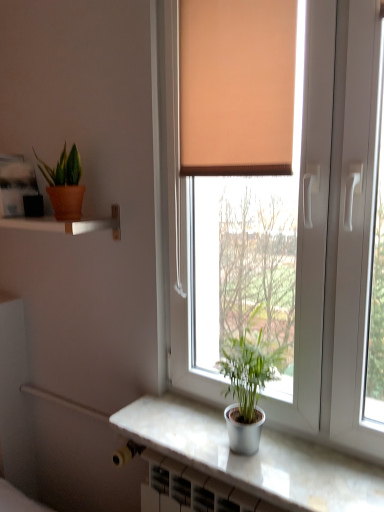
Locate an element on the screen. Image resolution: width=384 pixels, height=512 pixels. vacant point to the right of silver metallic pot at window, the 2th houseplant when ordered from back to front is located at coordinates (309, 465).